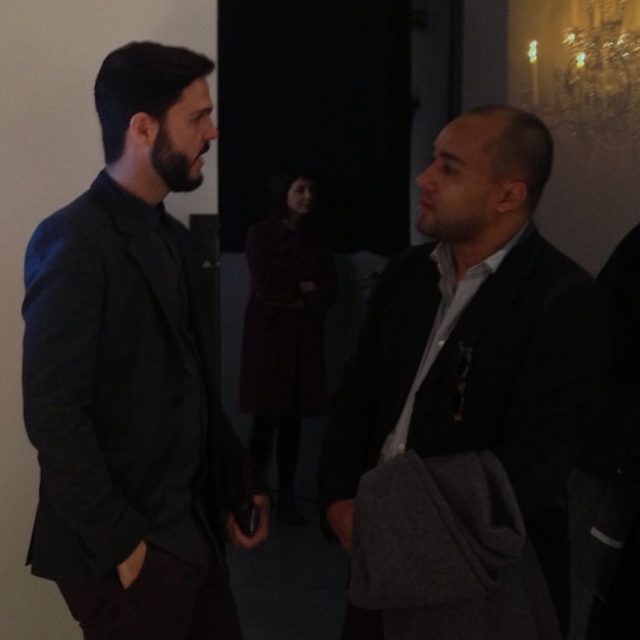
You are standing in the room and want to locate the matte black jacket at right. According to the coordinates given, where would you find it?

The matte black jacket at right is located at coordinates point (476, 339).

You are a photographer at a formal event and need to capture a closeup shot of both the matte black suit at left and the dark gray suit at right. The camera you are using has a maximum focus range of 1.2 meters. Can you fit both subjects within the camera focus range?

The matte black suit at left is 1.00 meters away from the dark gray suit at right. Since the distance between them is within the camera focus range of 1.2 meters, you can fit both subjects within the camera focus range.